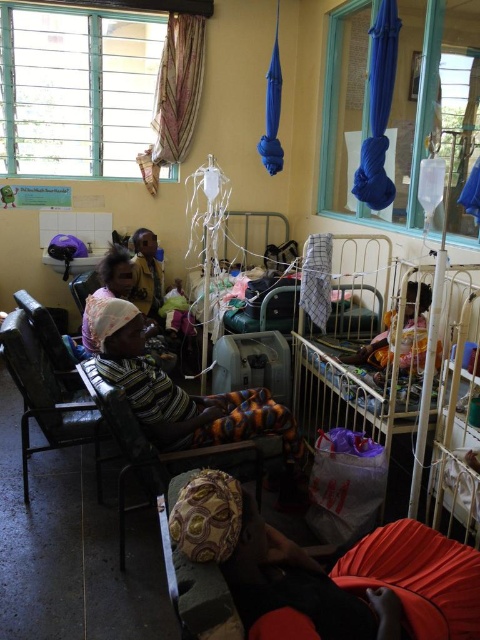
Question: Does wooden fabric chair at center have a smaller size compared to dark brown fabric at center?

Choices:
 (A) yes
 (B) no

Answer: (B)

Question: Among these points, which one is nearest to the camera?

Choices:
 (A) (472, 266)
 (B) (207, 456)

Answer: (B)

Question: Is metallic white hospital bed at lower right further to camera compared to leather-like chair at left?

Choices:
 (A) no
 (B) yes

Answer: (A)

Question: Which object is closer to the camera taking this photo?

Choices:
 (A) wooden fabric chair at center
 (B) leather-like chair at left
 (C) metallic white hospital bed at lower right
 (D) dark brown fabric at center

Answer: (C)

Question: Which point appears closest to the camera in this image?

Choices:
 (A) (4, 346)
 (B) (361, 244)
 (C) (229, 467)

Answer: (C)

Question: Does metallic white hospital bed at lower right have a lesser width compared to leather-like chair at left?

Choices:
 (A) yes
 (B) no

Answer: (B)